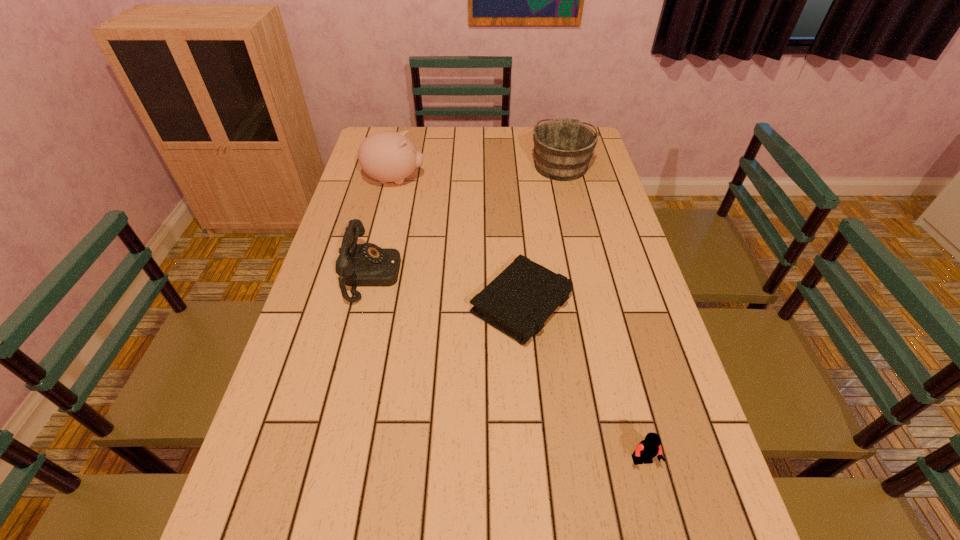
Identify the location of object that is positioned at the far edge. The image size is (960, 540). (563, 148).

Where is `piggy bank situated at the left edge`? Image resolution: width=960 pixels, height=540 pixels. piggy bank situated at the left edge is located at coordinates (388, 156).

Identify the location of telephone situated at the left edge. This screenshot has height=540, width=960. (366, 264).

In order to click on wine bucket located at the right edge in this screenshot , I will do `click(563, 148)`.

Where is `Lego located in the right edge section of the desktop`? This screenshot has width=960, height=540. Lego located in the right edge section of the desktop is located at coordinates (648, 448).

At what (x,y) coordinates should I click in order to perform the action: click on object that is at the far right corner. Please return your answer as a coordinate pair (x, y). The height and width of the screenshot is (540, 960). Looking at the image, I should click on (563, 148).

The image size is (960, 540). I want to click on vacant area at the far edge, so click(x=502, y=131).

At what (x,y) coordinates should I click in order to perform the action: click on vacant area at the left edge of the desktop. Please return your answer as a coordinate pair (x, y). Looking at the image, I should click on (300, 354).

The image size is (960, 540). I want to click on free space at the right edge of the desktop, so click(x=646, y=500).

Locate an element on the screen. The width and height of the screenshot is (960, 540). blank region between the wine bucket and the fourth tallest object is located at coordinates (602, 313).